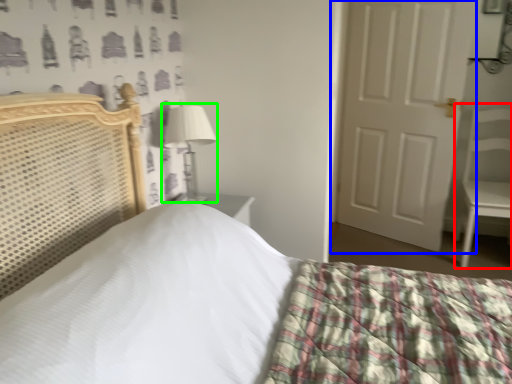
Question: Which object is positioned closest to armchair (highlighted by a red box)? Select from door (highlighted by a blue box) and table lamp (highlighted by a green box).

Choices:
 (A) door
 (B) table lamp

Answer: (A)